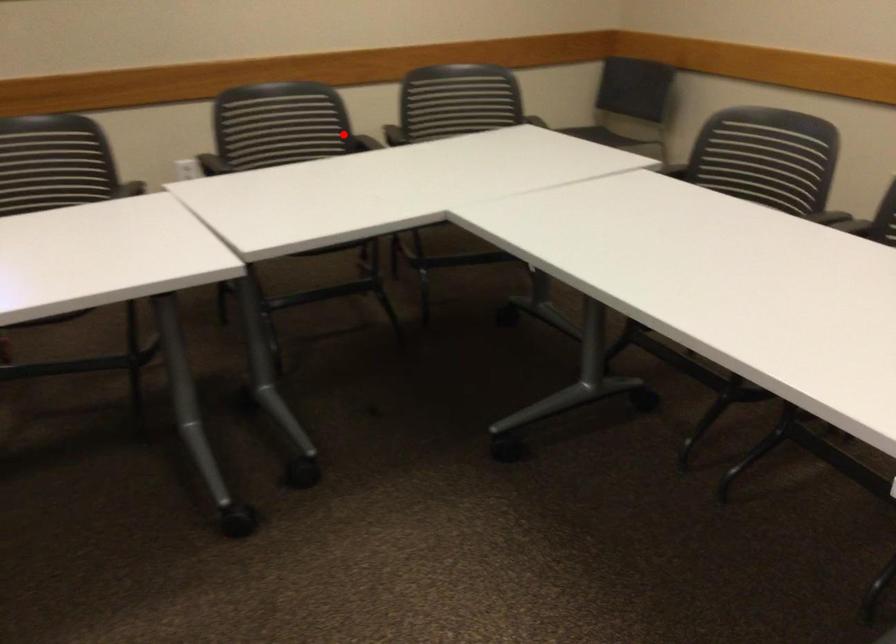
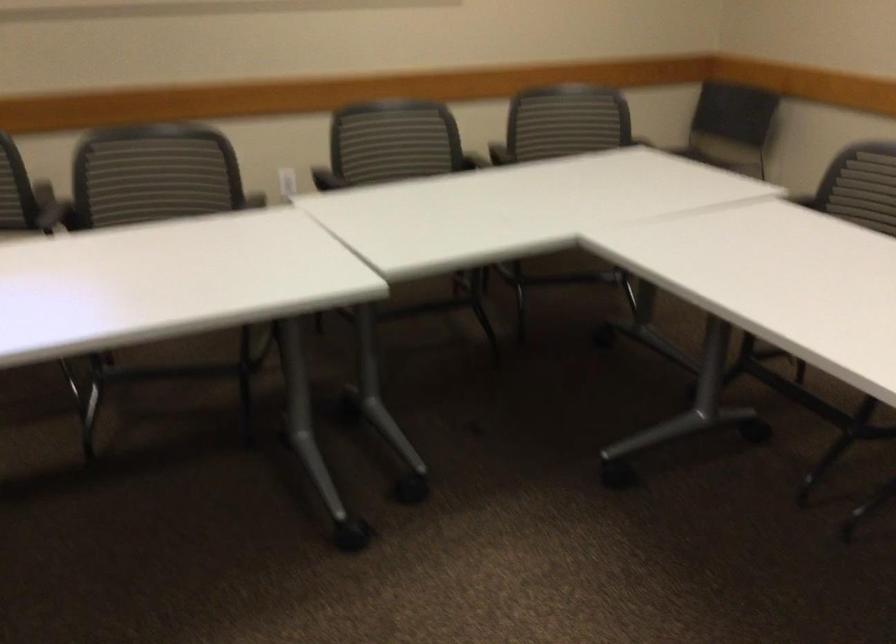
Where in the second image is the point corresponding to the highlighted location from the first image?

(458, 151)